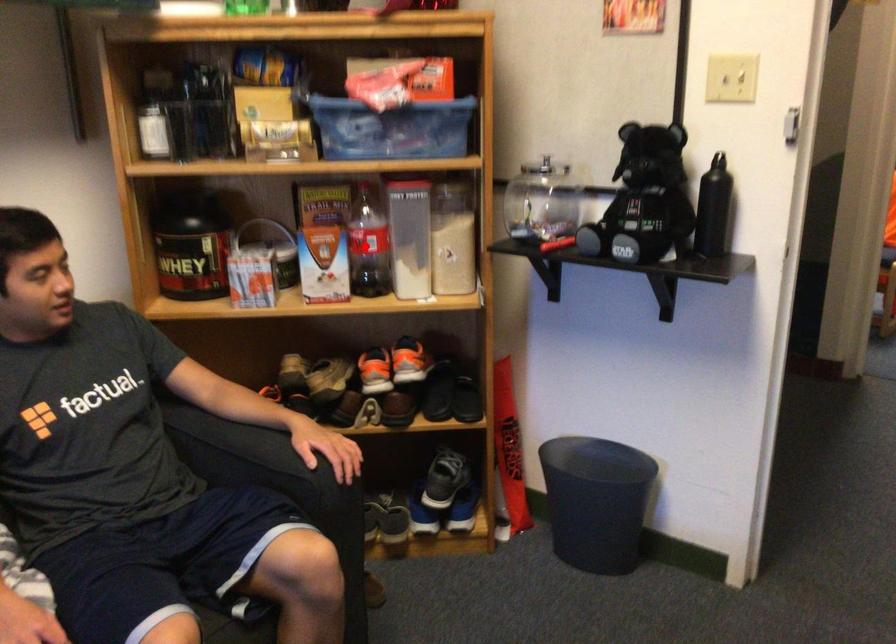
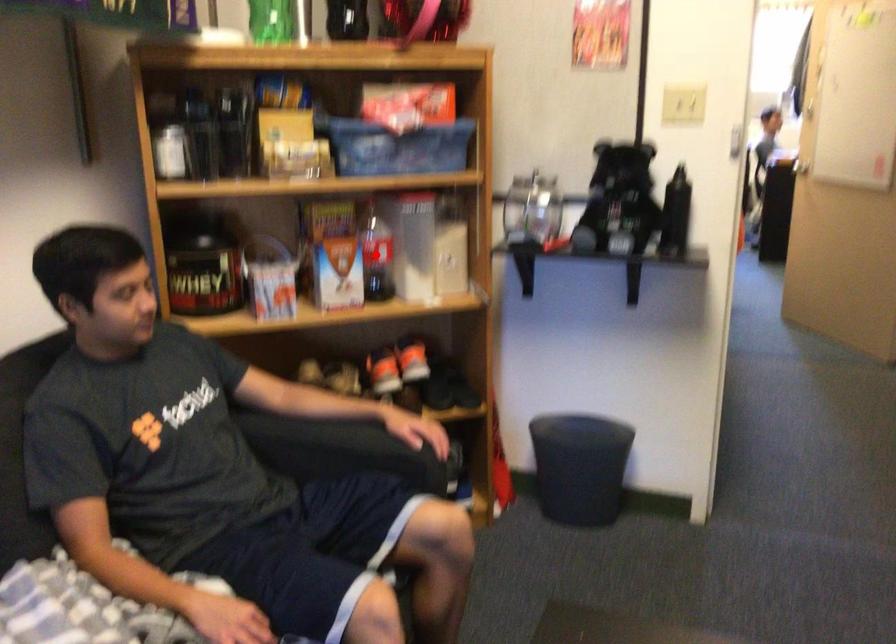
I am providing you with two images of the same scene from different viewpoints. A red point is marked on the first image and another point is marked on the second image. Do the highlighted points in image1 and image2 indicate the same real-world spot?

Yes